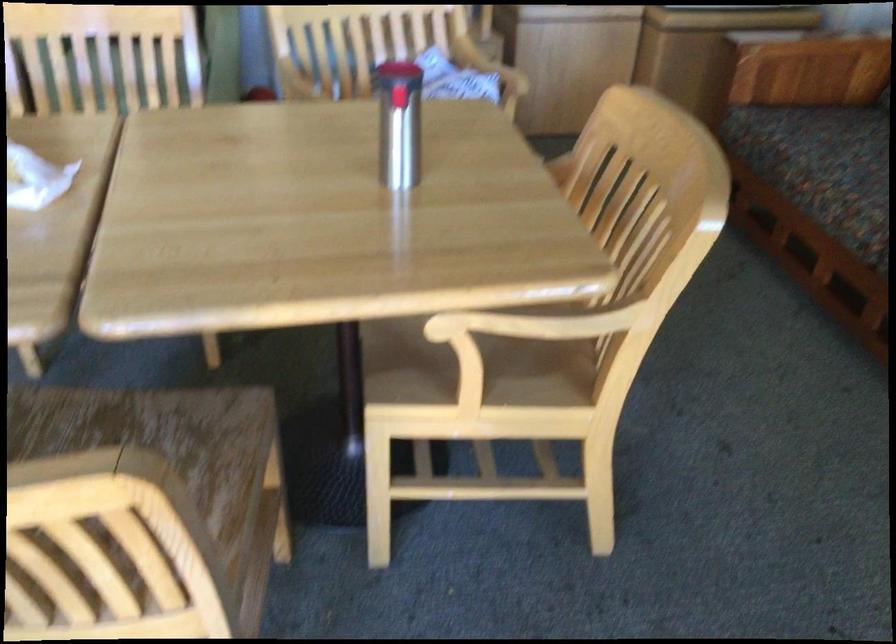
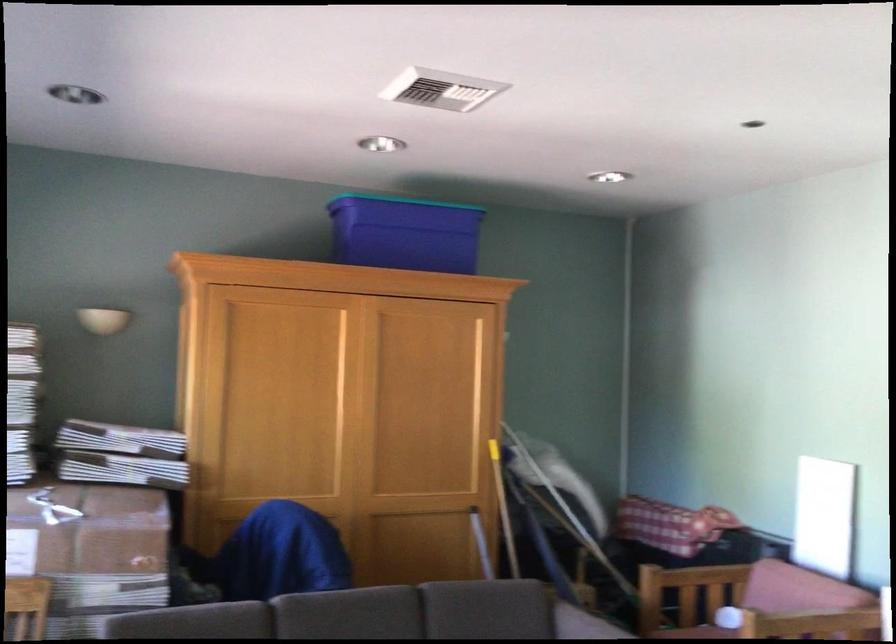
Question: How did the camera likely rotate?

Choices:
 (A) Left
 (B) Right
 (C) Up
 (D) Down

Answer: (A)